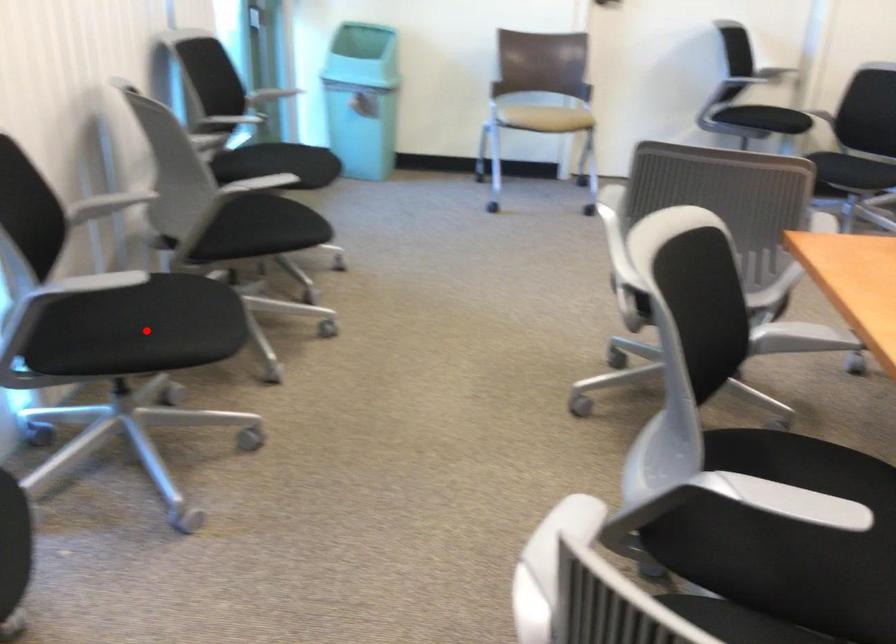
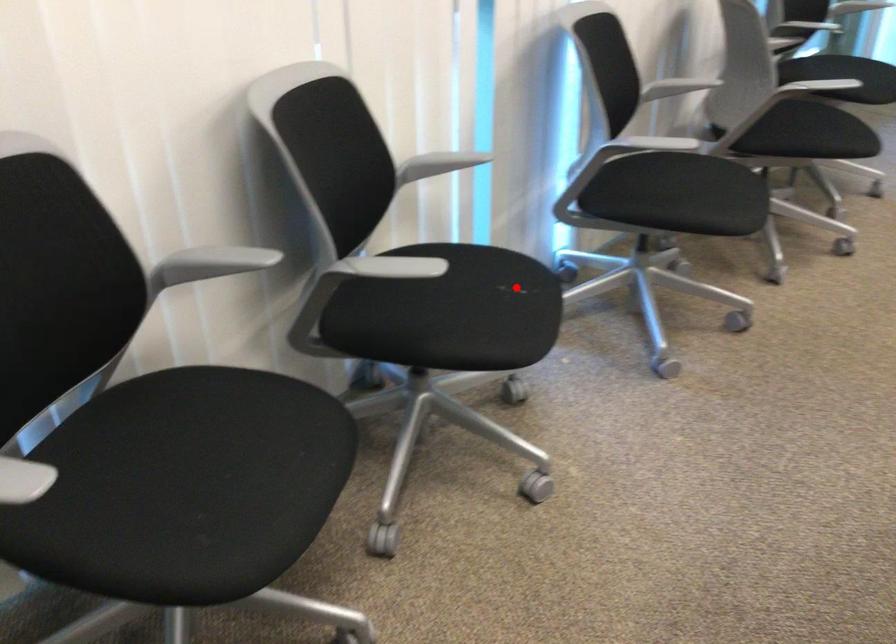
I am providing you with two images of the same scene from different viewpoints. A red point is marked on the first image and another point is marked on the second image. Do the highlighted points in image1 and image2 indicate the same real-world spot?

No